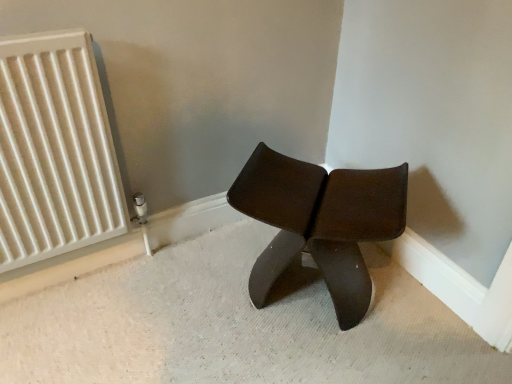
Question: From a real-world perspective, is white matte radiator at left above or below matte brown stool at center?

Choices:
 (A) below
 (B) above

Answer: (B)

Question: Is white matte radiator at left taller or shorter than matte brown stool at center?

Choices:
 (A) tall
 (B) short

Answer: (A)

Question: Relative to matte brown stool at center, is white matte radiator at left in front or behind?

Choices:
 (A) front
 (B) behind

Answer: (A)

Question: From a real-world perspective, is matte brown stool at center physically located above or below white matte radiator at left?

Choices:
 (A) below
 (B) above

Answer: (A)

Question: Looking at their shapes, would you say matte brown stool at center is wider or thinner than white matte radiator at left?

Choices:
 (A) thin
 (B) wide

Answer: (B)

Question: Is matte brown stool at center spatially inside white matte radiator at left, or outside of it?

Choices:
 (A) outside
 (B) inside

Answer: (A)

Question: From the image's perspective, is matte brown stool at center positioned above or below white matte radiator at left?

Choices:
 (A) above
 (B) below

Answer: (B)